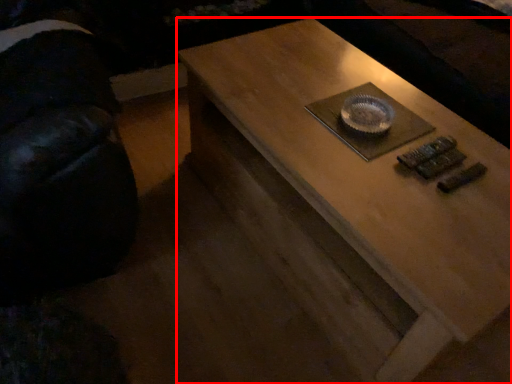
Question: From the image's perspective, considering the relative positions of coffee table (annotated by the red box) and swivel chair in the image provided, where is coffee table (annotated by the red box) located with respect to the staircase?

Choices:
 (A) above
 (B) below

Answer: (B)